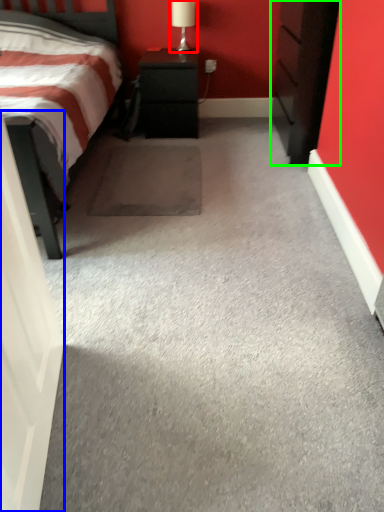
Question: Estimate the real-world distances between objects in this image. Which object is closer to table lamp (highlighted by a red box), door (highlighted by a blue box) or chest of drawers (highlighted by a green box)?

Choices:
 (A) door
 (B) chest of drawers

Answer: (B)